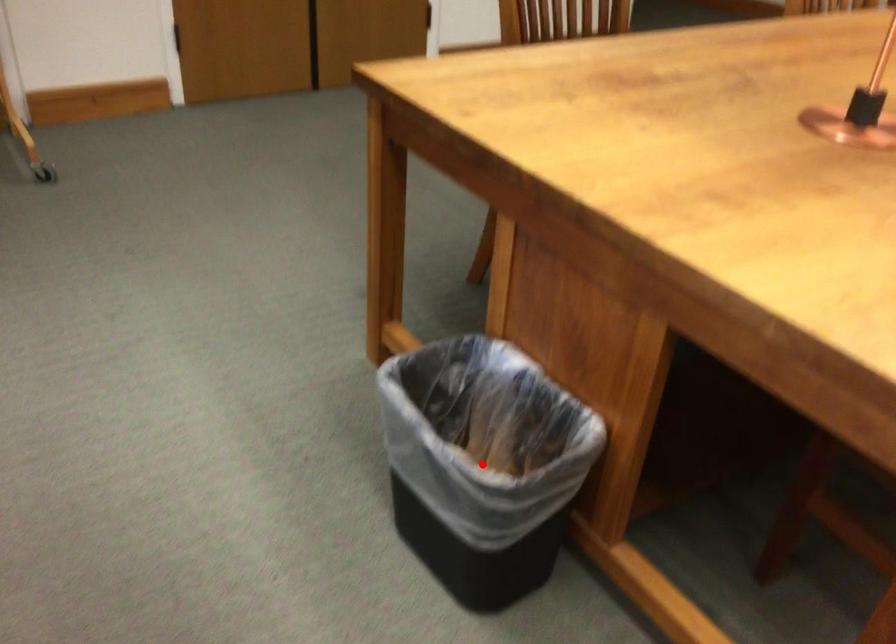
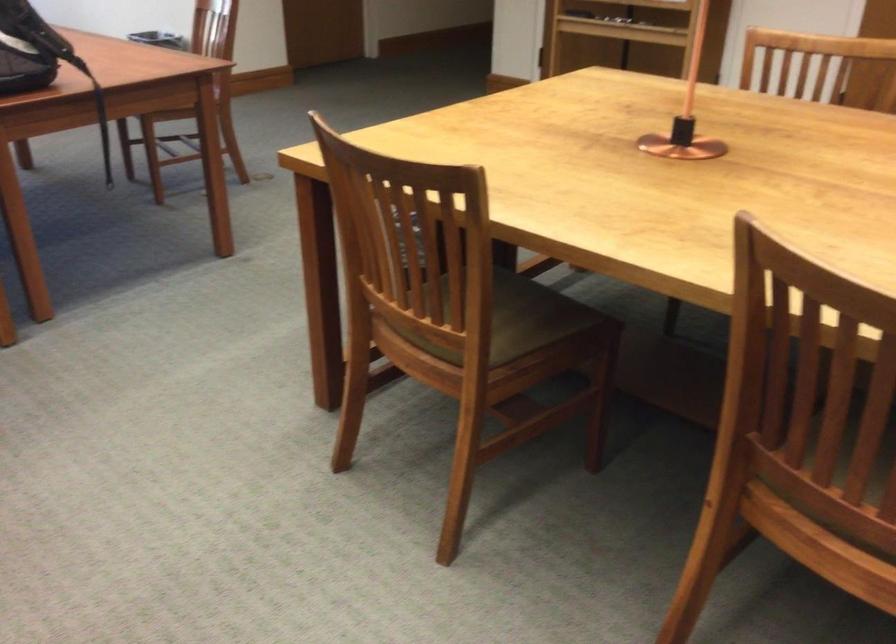
Question: I am providing you with two images of the same scene from different viewpoints. A red point is marked on the first image. At the location where the point appears in image 1, is it still visible in image 2?

Choices:
 (A) Yes
 (B) No

Answer: (B)